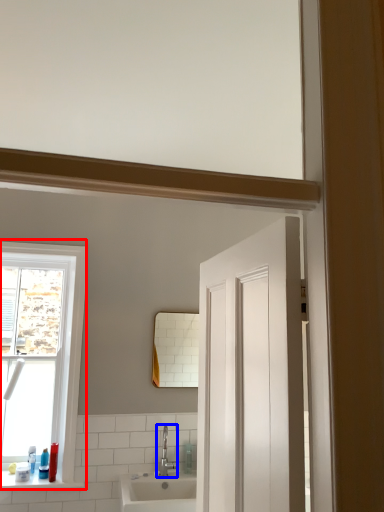
Question: Which of the following is the farthest to the observer, window (highlighted by a red box) or tap (highlighted by a blue box)?

Choices:
 (A) window
 (B) tap

Answer: (B)